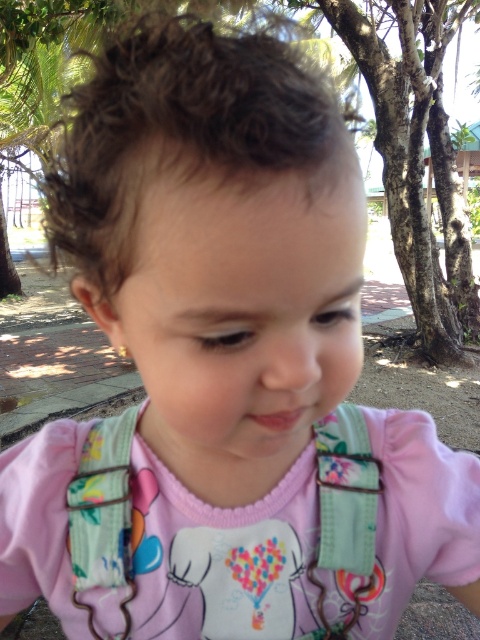
Question: Is floral fabric bib at center further to the viewer compared to smooth skin face at center?

Choices:
 (A) yes
 (B) no

Answer: (A)

Question: Which object appears farthest from the camera in this image?

Choices:
 (A) smooth skin face at center
 (B) floral fabric bib at center

Answer: (B)

Question: In this image, where is floral fabric bib at center located relative to smooth skin face at center?

Choices:
 (A) above
 (B) below

Answer: (B)

Question: Considering the relative positions of floral fabric bib at center and smooth skin face at center in the image provided, where is floral fabric bib at center located with respect to smooth skin face at center?

Choices:
 (A) below
 (B) above

Answer: (A)

Question: Which point is closer to the camera?

Choices:
 (A) (419, 572)
 (B) (181, 378)

Answer: (B)